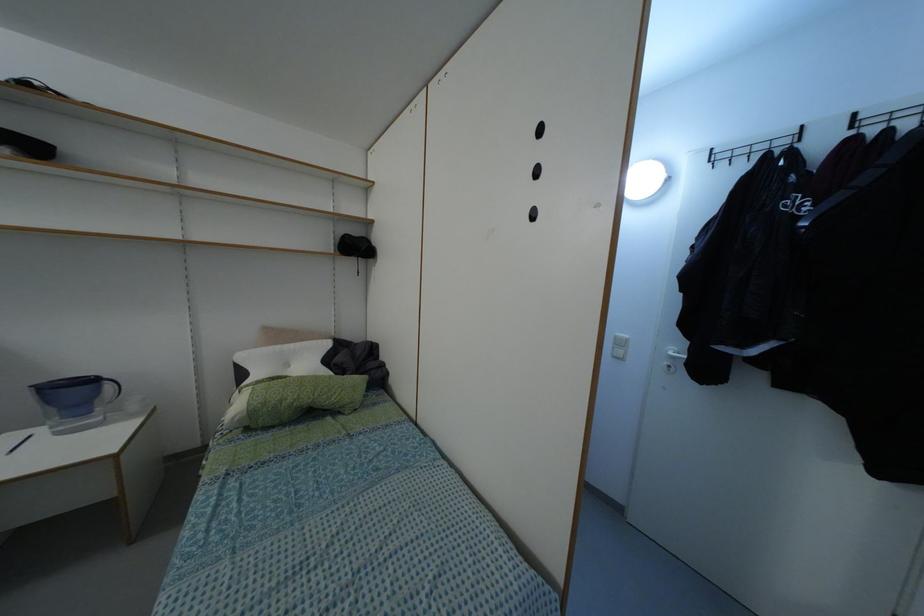
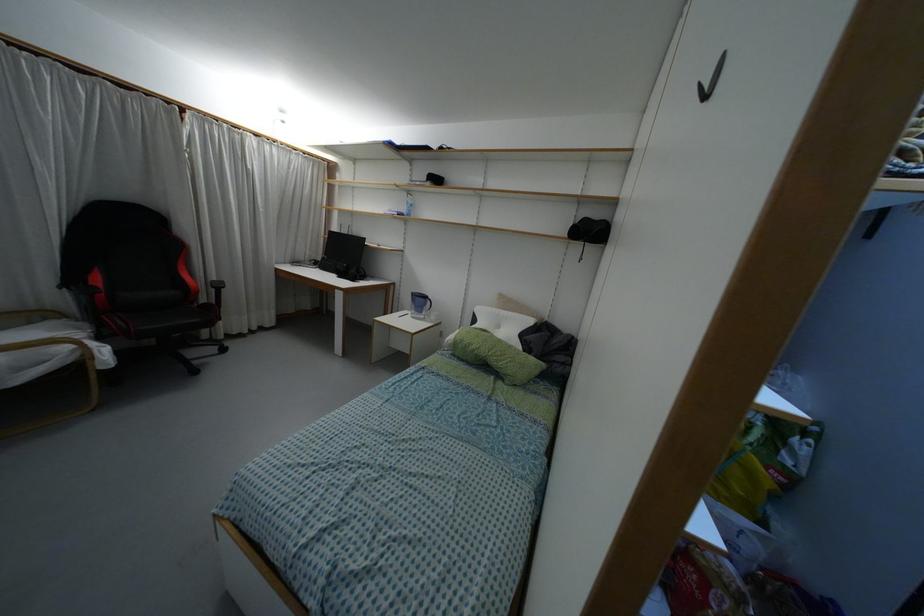
In the second image, find the point that corresponds to point 107,386 in the first image.

(428, 302)